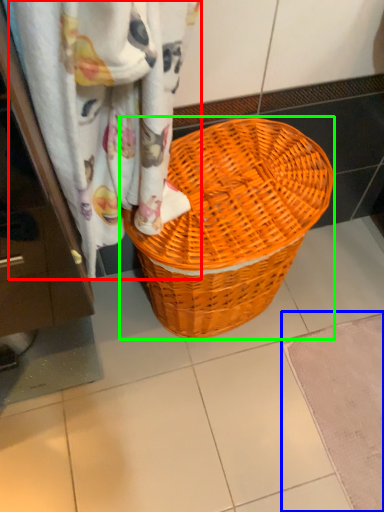
Question: Which is farther away from curtain (highlighted by a red box)? bath mat (highlighted by a blue box) or picnic basket (highlighted by a green box)?

Choices:
 (A) bath mat
 (B) picnic basket

Answer: (A)